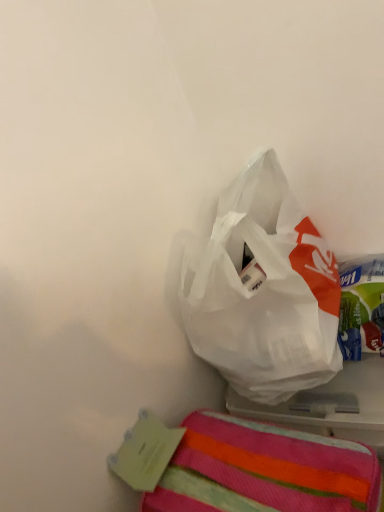
Question: Considering the relative positions of striped cotton towel at lower right and transparent plastic bag at upper center in the image provided, is striped cotton towel at lower right to the left or to the right of transparent plastic bag at upper center?

Choices:
 (A) right
 (B) left

Answer: (B)

Question: Choose the correct answer: Is striped cotton towel at lower right inside transparent plastic bag at upper center or outside it?

Choices:
 (A) inside
 (B) outside

Answer: (B)

Question: Is point (322, 455) closer or farther from the camera than point (243, 244)?

Choices:
 (A) farther
 (B) closer

Answer: (B)

Question: Considering the positions of transparent plastic bag at upper center and striped cotton towel at lower right in the image, is transparent plastic bag at upper center bigger or smaller than striped cotton towel at lower right?

Choices:
 (A) big
 (B) small

Answer: (A)

Question: Looking at their shapes, would you say transparent plastic bag at upper center is wider or thinner than striped cotton towel at lower right?

Choices:
 (A) thin
 (B) wide

Answer: (A)

Question: Is transparent plastic bag at upper center spatially inside striped cotton towel at lower right, or outside of it?

Choices:
 (A) outside
 (B) inside

Answer: (A)

Question: From their relative heights in the image, would you say transparent plastic bag at upper center is taller or shorter than striped cotton towel at lower right?

Choices:
 (A) tall
 (B) short

Answer: (A)